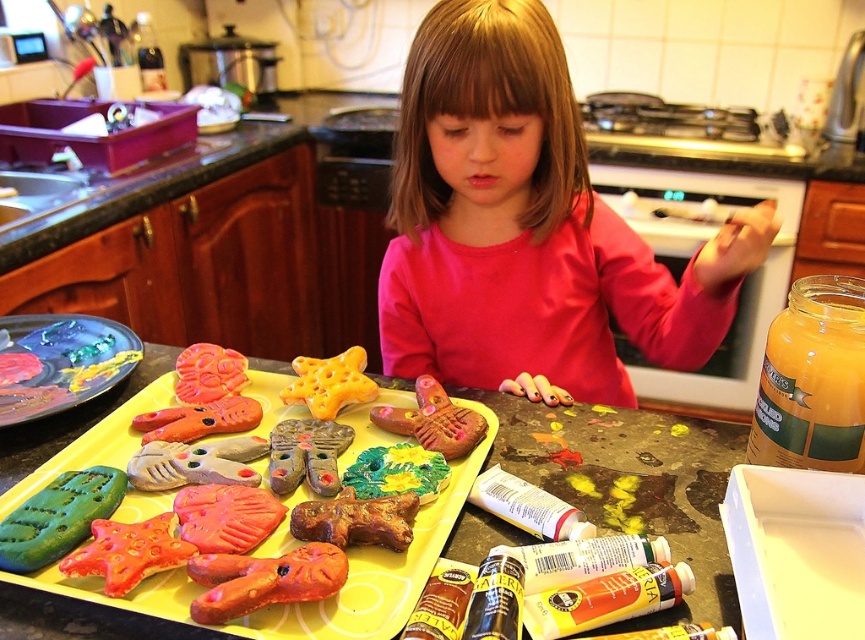
Question: Which point is farther from the camera taking this photo?

Choices:
 (A) (59, 592)
 (B) (799, 452)
 (C) (1, 554)

Answer: (B)

Question: Can you confirm if translucent glass jar at upper right is wider than painted ceramic plate at left?

Choices:
 (A) no
 (B) yes

Answer: (A)

Question: Which point is closer to the camera taking this photo?

Choices:
 (A) (814, 296)
 (B) (386, 456)
 (C) (537, 88)

Answer: (A)

Question: Is translucent glass jar at upper right above yellow matte star at center?

Choices:
 (A) yes
 (B) no

Answer: (A)

Question: Does matte clay cookies at center lie behind translucent glass jar at upper right?

Choices:
 (A) yes
 (B) no

Answer: (B)

Question: Which point is closer to the camera taking this photo?

Choices:
 (A) (293, 385)
 (B) (236, 564)
 (C) (56, 524)
 (D) (370, 476)

Answer: (B)